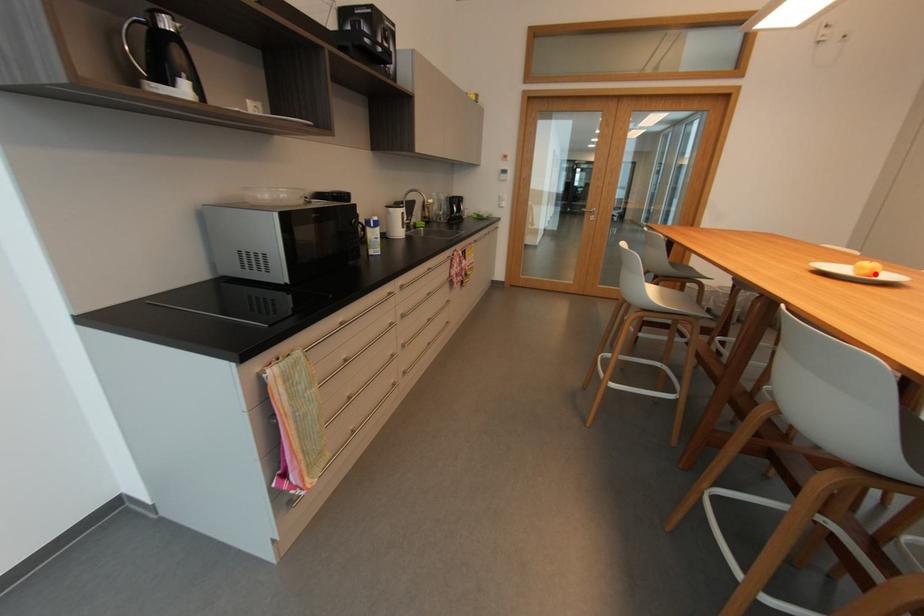
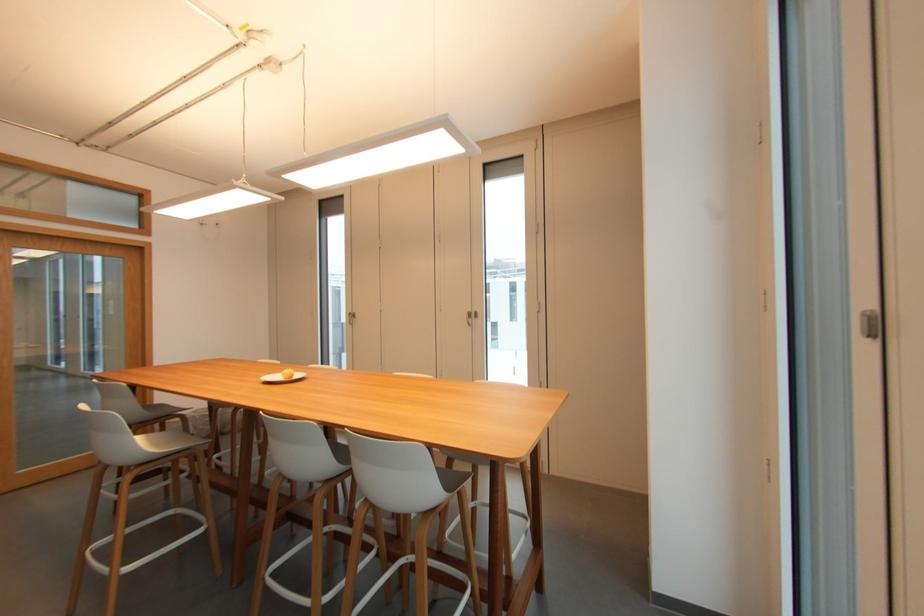
The point at the highlighted location is marked in the first image. Where is the corresponding point in the second image?

(296, 377)